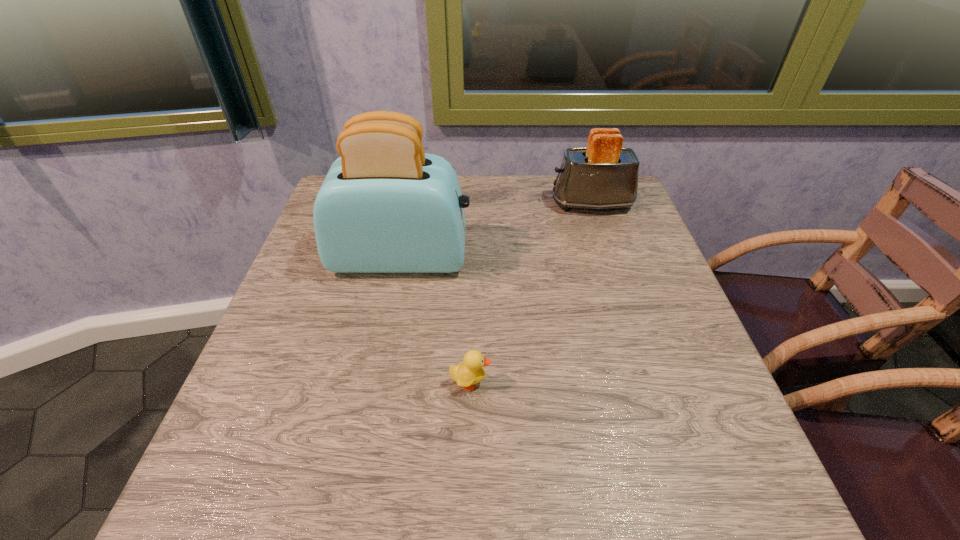
Where is `free region located on the front-facing side of the nearest object`? Image resolution: width=960 pixels, height=540 pixels. free region located on the front-facing side of the nearest object is located at coordinates (684, 382).

Locate an element on the screen. object positioned at the far edge is located at coordinates (604, 175).

Locate an element on the screen. The height and width of the screenshot is (540, 960). object located in the left edge section of the desktop is located at coordinates (385, 206).

This screenshot has height=540, width=960. What are the coordinates of `object at the right edge` in the screenshot? It's located at (604, 175).

Locate an element on the screen. This screenshot has height=540, width=960. object present at the far right corner is located at coordinates (604, 175).

In the image, there is a desktop. In order to click on vacant space at the near edge in this screenshot , I will do `click(476, 518)`.

Where is `vacant space at the left edge of the desktop`? vacant space at the left edge of the desktop is located at coordinates (311, 248).

In the image, there is a desktop. Where is `vacant area at the right edge`? The width and height of the screenshot is (960, 540). vacant area at the right edge is located at coordinates (607, 314).

The width and height of the screenshot is (960, 540). Find the location of `vacant space at the near left corner of the desktop`. vacant space at the near left corner of the desktop is located at coordinates click(265, 496).

Find the location of `free space at the near right corner of the desktop`. free space at the near right corner of the desktop is located at coordinates (762, 490).